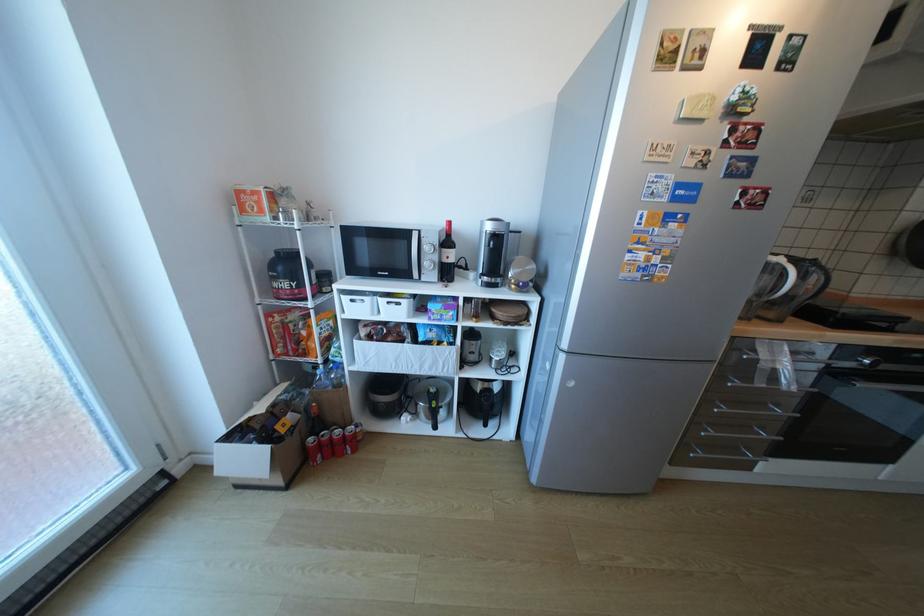
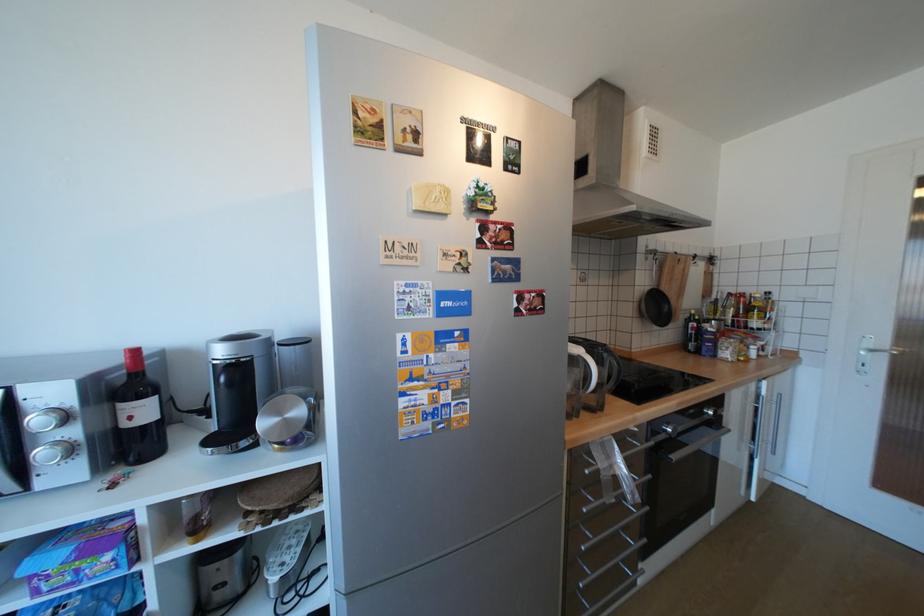
Find the pixel in the second image that matches pixel 456 257 in the first image.

(140, 418)